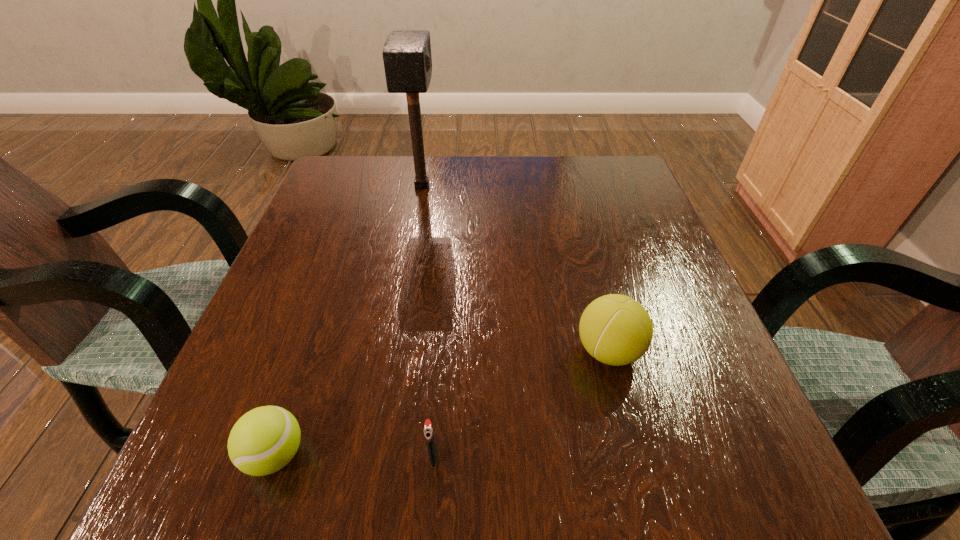
Image resolution: width=960 pixels, height=540 pixels. I want to click on the tallest object, so [407, 59].

The height and width of the screenshot is (540, 960). In order to click on the second object from left to right in this screenshot , I will do `click(407, 59)`.

Identify the location of the rightmost object. (617, 330).

At what (x,y) coordinates should I click in order to perform the action: click on the third shortest object. Please return your answer as a coordinate pair (x, y). Image resolution: width=960 pixels, height=540 pixels. Looking at the image, I should click on [617, 330].

This screenshot has height=540, width=960. Identify the location of the nearer tennis ball. (264, 440).

You are a GUI agent. You are given a task and a screenshot of the screen. Output one action in this format:
    pyautogui.click(x=<x>, y=<y>)
    Task: Click on the leftmost object
    
    Given the screenshot: What is the action you would take?
    pyautogui.click(x=264, y=440)

Image resolution: width=960 pixels, height=540 pixels. Find the location of `the second object from right to left`. the second object from right to left is located at coordinates (428, 430).

The width and height of the screenshot is (960, 540). What are the coordinates of `vacant space located on the right of the mallet` in the screenshot? It's located at (525, 186).

Find the location of `vacant area located on the back of the second farthest object`. vacant area located on the back of the second farthest object is located at coordinates (596, 303).

Locate an element on the screen. This screenshot has width=960, height=540. blank space located 0.070m on the left of the nearer tennis ball is located at coordinates (192, 455).